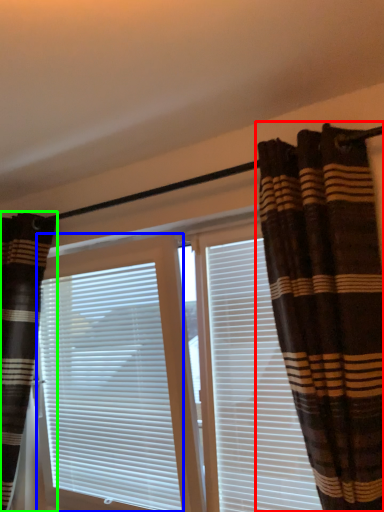
Question: Which is nearer to the curtain (highlighted by a red box)? window blind (highlighted by a blue box) or curtain (highlighted by a green box).

Choices:
 (A) window blind
 (B) curtain

Answer: (A)